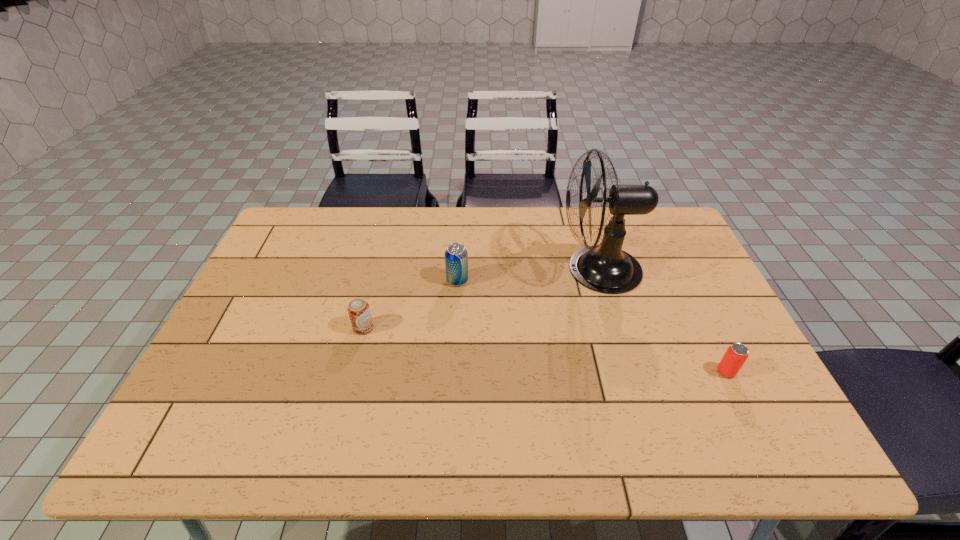
This screenshot has width=960, height=540. Identify the location of vacant space that satisfies the following two spatial constraints: 1. on the back side of the nearest beer can; 2. on the front-facing side of the fan. (677, 269).

This screenshot has height=540, width=960. Find the location of `vacant point that satisfies the following two spatial constraints: 1. on the front-facing side of the rightmost object; 2. on the left side of the tallest object`. vacant point that satisfies the following two spatial constraints: 1. on the front-facing side of the rightmost object; 2. on the left side of the tallest object is located at coordinates (630, 372).

Locate an element on the screen. This screenshot has height=540, width=960. vacant space that satisfies the following two spatial constraints: 1. on the front-facing side of the tallest object; 2. on the front side of the second beer can from right to left is located at coordinates (603, 280).